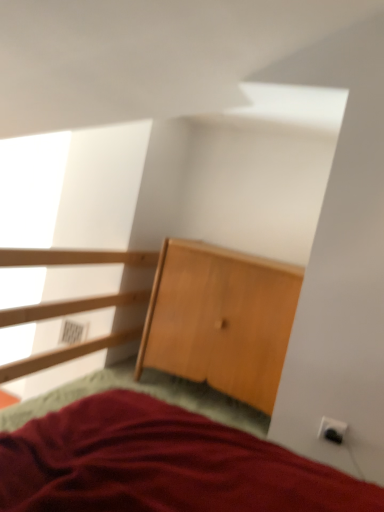
Question: Is light brown wooden dresser at center inside or outside of white plastic electric outlet at lower right, the first electric outlet when ordered from front to back?

Choices:
 (A) inside
 (B) outside

Answer: (B)

Question: From a real-world perspective, is light brown wooden dresser at center physically located above or below white plastic electric outlet at lower right, the first electric outlet when ordered from front to back?

Choices:
 (A) above
 (B) below

Answer: (A)

Question: Which of these objects is positioned farthest from the light brown wooden dresser at center?

Choices:
 (A) transparent glass window at upper left
 (B) white plastic electric outlet at lower right, marked as the 1th electric outlet in a back-to-front arrangement
 (C) white plastic electric outlet at lower right, which is the 2th electric outlet from back to front

Answer: (B)

Question: Estimate the real-world distances between objects in this image. Which object is farther from the transparent glass window at upper left?

Choices:
 (A) light brown wooden dresser at center
 (B) white plastic electric outlet at lower right, which is the 2th electric outlet from back to front
 (C) white plastic electric outlet at lower right, the 2th electric outlet in the right-to-left sequence

Answer: (B)